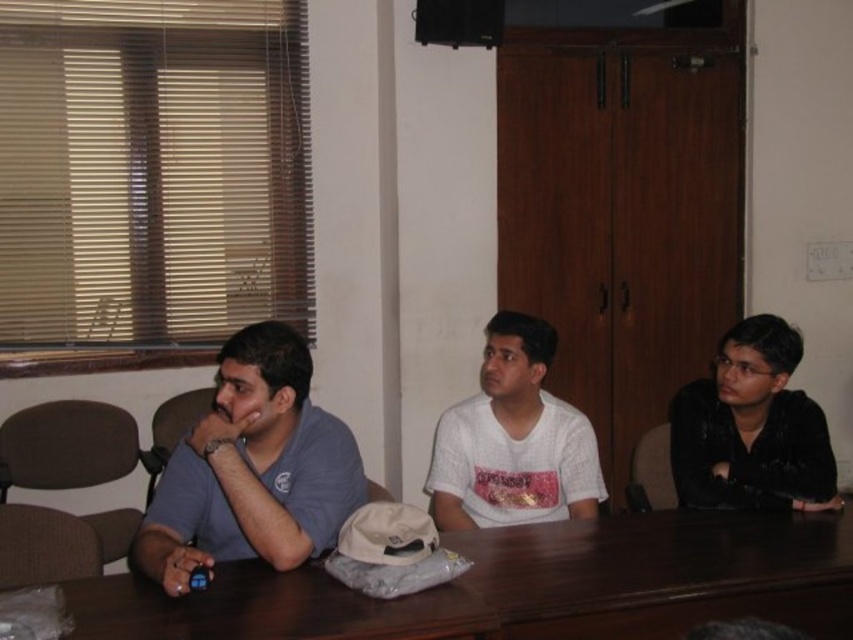
Question: Can you confirm if brown wooden table at center is positioned to the left of blue matte shirt at left?

Choices:
 (A) yes
 (B) no

Answer: (B)

Question: Which of the following is the closest to the observer?

Choices:
 (A) (682, 550)
 (B) (502, 368)
 (C) (154, 497)

Answer: (A)

Question: Which object is farther from the camera taking this photo?

Choices:
 (A) blue matte shirt at left
 (B) brown wooden table at center

Answer: (A)

Question: Does blue matte shirt at left lie in front of white matte shirt at center?

Choices:
 (A) yes
 (B) no

Answer: (A)

Question: Where is blue matte shirt at left located in relation to white matte shirt at center in the image?

Choices:
 (A) above
 (B) below

Answer: (B)

Question: Which object appears farthest from the camera in this image?

Choices:
 (A) blue matte shirt at left
 (B) white matte shirt at center
 (C) brown wooden table at center

Answer: (B)